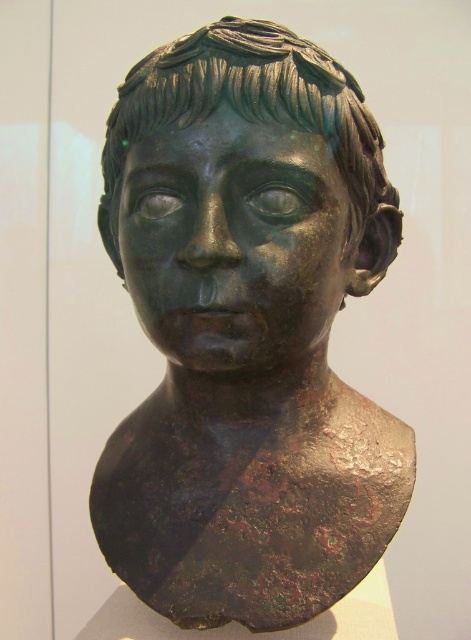
Can you confirm if bronze bust at center is positioned to the right of shiny bronze face at center?

Yes, bronze bust at center is to the right of shiny bronze face at center.

Does point (188, 93) come in front of point (257, 172)?

That is True.

Where is `bronze bust at center`? bronze bust at center is located at coordinates tap(246, 330).